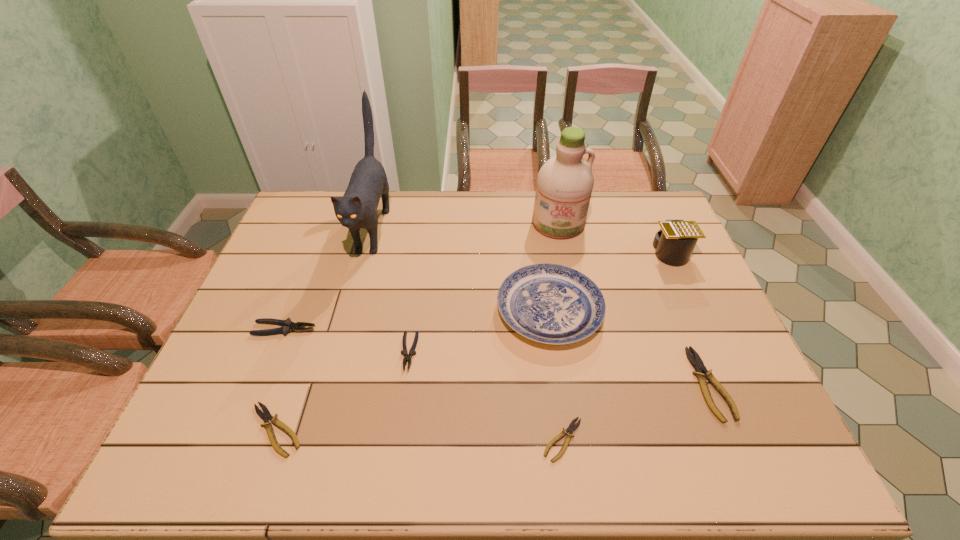
The height and width of the screenshot is (540, 960). What are the coordinates of `free space at the near edge of the desktop` in the screenshot? It's located at (308, 436).

In the image, there is a desktop. At what (x,y) coordinates should I click in order to perform the action: click on vacant space at the left edge. Please return your answer as a coordinate pair (x, y). The height and width of the screenshot is (540, 960). Looking at the image, I should click on (288, 335).

You are a GUI agent. You are given a task and a screenshot of the screen. Output one action in this format:
    pyautogui.click(x=<x>, y=<y>)
    Task: Click on the vacant space at the right edge of the desktop
    
    Given the screenshot: What is the action you would take?
    pyautogui.click(x=689, y=342)

Image resolution: width=960 pixels, height=540 pixels. Find the location of `free space at the far left corner of the desktop`. free space at the far left corner of the desktop is located at coordinates (327, 213).

Locate an element on the screen. The image size is (960, 540). vacant space at the far right corner of the desktop is located at coordinates (658, 227).

At what (x,y) coordinates should I click in order to perform the action: click on empty space that is in between the sixth shortest object and the leftmost yellow pliers. Please return your answer as a coordinate pair (x, y). Looking at the image, I should click on (413, 370).

Where is `vacant space in between the cat and the fourth tallest object`? vacant space in between the cat and the fourth tallest object is located at coordinates (461, 269).

Where is `free space that is in between the bigger gray pliers and the sixth object from right to left`? This screenshot has width=960, height=540. free space that is in between the bigger gray pliers and the sixth object from right to left is located at coordinates (347, 341).

Find the location of a particular element. This screenshot has width=960, height=540. free space between the gray cat and the cleansing agent is located at coordinates (466, 226).

I want to click on vacant space that's between the second smallest yellow pliers and the bigger gray pliers, so click(280, 380).